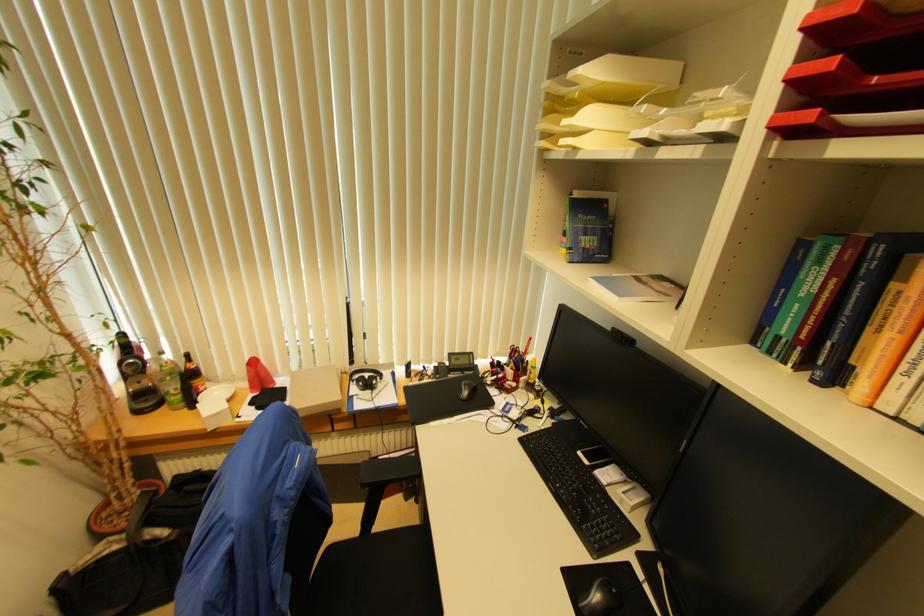
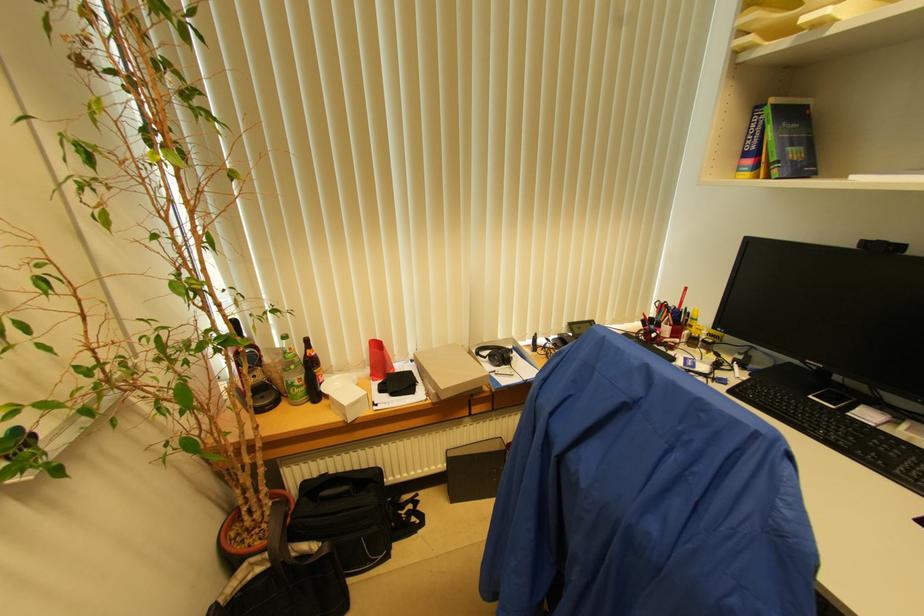
Find the pixel in the second image that matches point (180, 389) in the first image.

(304, 379)